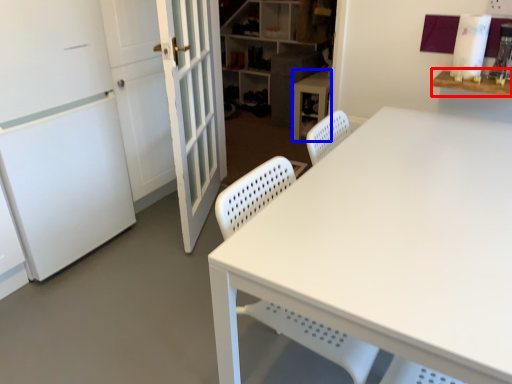
Question: Which point is further to the camera, table (highlighted by a red box) or computer desk (highlighted by a blue box)?

Choices:
 (A) table
 (B) computer desk

Answer: (B)